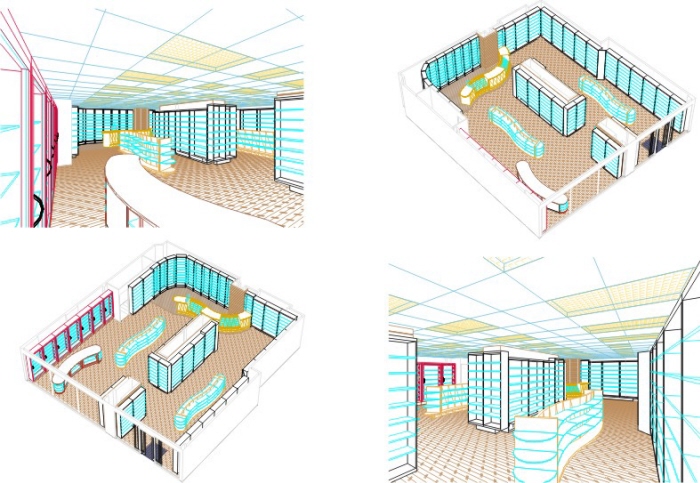
This screenshot has width=700, height=483. I want to click on desk, so click(x=164, y=207).